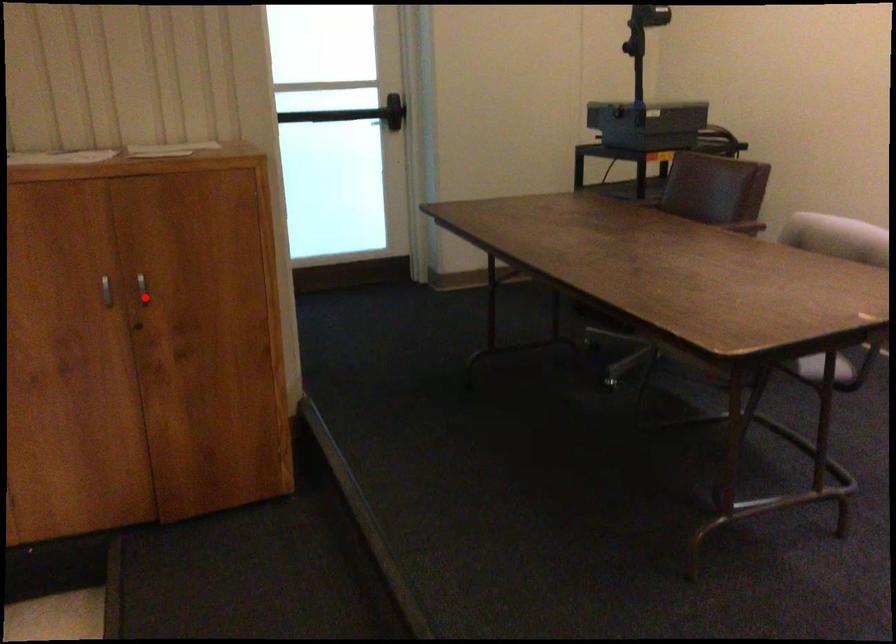
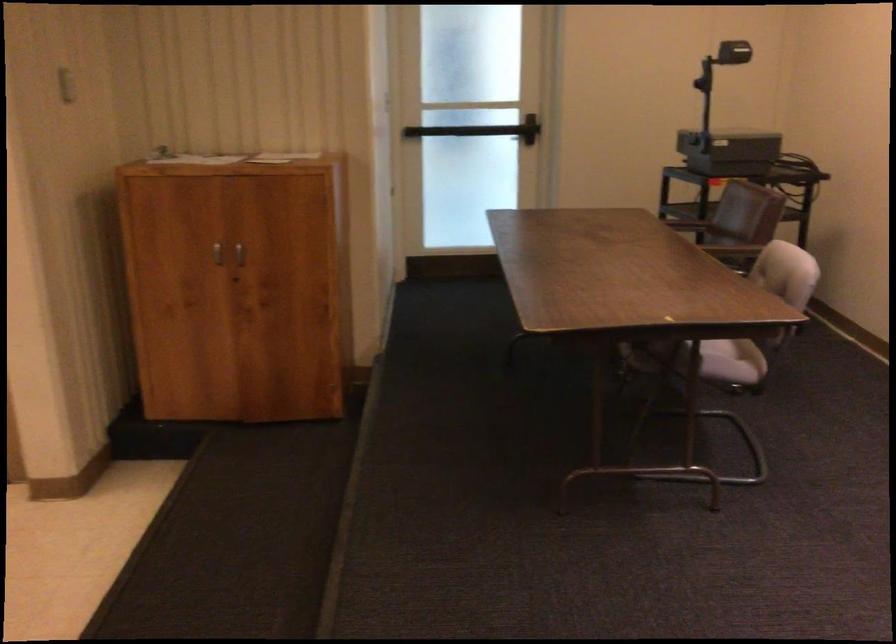
Locate, in the second image, the point that corresponds to the highlighted location in the first image.

(238, 258)